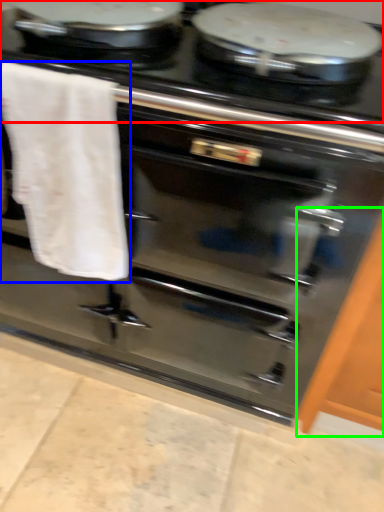
Question: Which object is the farthest from gas stove (highlighted by a red box)? Choose among these: bath towel (highlighted by a blue box) or cabinetry (highlighted by a green box).

Choices:
 (A) bath towel
 (B) cabinetry

Answer: (B)